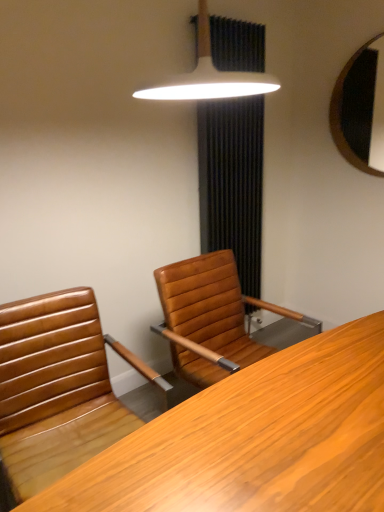
Question: Considering the relative sizes of wooden desk at center and brown leather chair at center in the image provided, is wooden desk at center taller than brown leather chair at center?

Choices:
 (A) yes
 (B) no

Answer: (B)

Question: Considering the relative sizes of wooden desk at center and brown leather chair at center in the image provided, is wooden desk at center thinner than brown leather chair at center?

Choices:
 (A) no
 (B) yes

Answer: (B)

Question: Is the depth of wooden desk at center less than that of brown leather chair at center?

Choices:
 (A) yes
 (B) no

Answer: (A)

Question: From the image's perspective, is wooden desk at center below brown leather chair at center?

Choices:
 (A) no
 (B) yes

Answer: (B)

Question: Is brown leather chair at center a part of wooden desk at center?

Choices:
 (A) yes
 (B) no

Answer: (B)

Question: From a real-world perspective, is wooden desk at center located beneath brown leather chair at center?

Choices:
 (A) yes
 (B) no

Answer: (A)

Question: Is wooden mirror at upper right far away from wooden desk at center?

Choices:
 (A) no
 (B) yes

Answer: (B)

Question: Is wooden mirror at upper right smaller than wooden desk at center?

Choices:
 (A) yes
 (B) no

Answer: (A)

Question: From the image's perspective, is wooden mirror at upper right on top of wooden desk at center?

Choices:
 (A) yes
 (B) no

Answer: (A)

Question: Can you confirm if wooden mirror at upper right is thinner than wooden desk at center?

Choices:
 (A) yes
 (B) no

Answer: (A)

Question: Is wooden mirror at upper right wider than wooden desk at center?

Choices:
 (A) no
 (B) yes

Answer: (A)

Question: Can you confirm if wooden mirror at upper right is shorter than wooden desk at center?

Choices:
 (A) yes
 (B) no

Answer: (B)

Question: Can you confirm if brown leather chair at center is wider than wooden mirror at upper right?

Choices:
 (A) no
 (B) yes

Answer: (B)